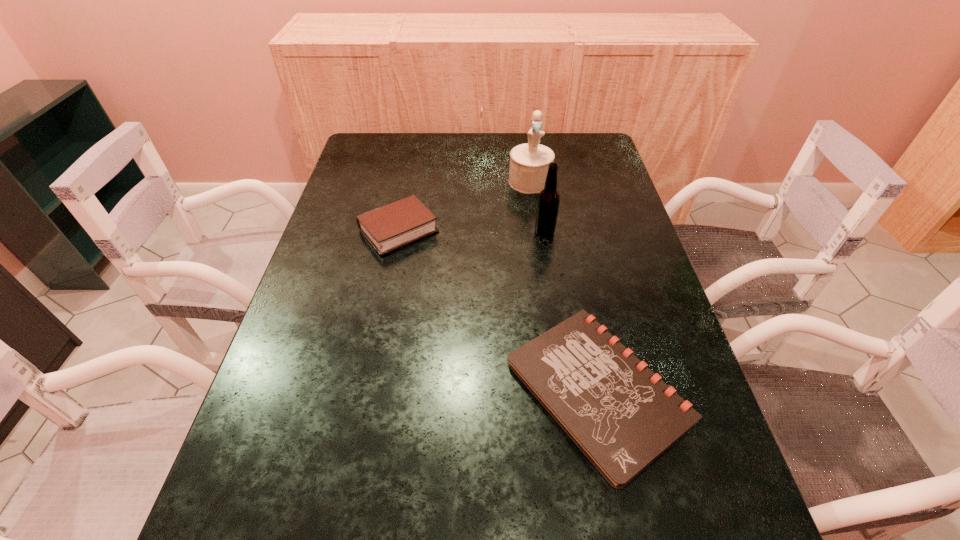
This screenshot has width=960, height=540. What are the coordinates of `free point between the figurine and the third tallest object` in the screenshot? It's located at (465, 206).

Where is `vacant area between the farthest object and the leftmost object`? vacant area between the farthest object and the leftmost object is located at coordinates (465, 206).

I want to click on empty space that is in between the nearest object and the beer bottle, so click(571, 312).

The height and width of the screenshot is (540, 960). I want to click on free space between the beer bottle and the shortest object, so click(571, 312).

Find the location of a particular element. This screenshot has width=960, height=540. free spot between the beer bottle and the third tallest object is located at coordinates (471, 231).

Identify which object is located as the third nearest to the beer bottle. Please provide its 2D coordinates. Your answer should be formatted as a tuple, i.e. [(x, y)], where the tuple contains the x and y coordinates of a point satisfying the conditions above.

[(620, 414)]

The width and height of the screenshot is (960, 540). Find the location of `object that ranks as the third closest to the leftmost object`. object that ranks as the third closest to the leftmost object is located at coordinates (620, 414).

Identify the location of vacant position in the image that satisfies the following two spatial constraints: 1. at the beak of the shortest object; 2. on the right side of the figurine. (559, 390).

Where is `vacant region that satisfies the following two spatial constraints: 1. at the beak of the beer bottle; 2. on the left side of the figurine`? vacant region that satisfies the following two spatial constraints: 1. at the beak of the beer bottle; 2. on the left side of the figurine is located at coordinates (537, 232).

Locate an element on the screen. This screenshot has width=960, height=540. blank space that satisfies the following two spatial constraints: 1. at the beak of the shortest object; 2. on the left side of the figurine is located at coordinates (559, 390).